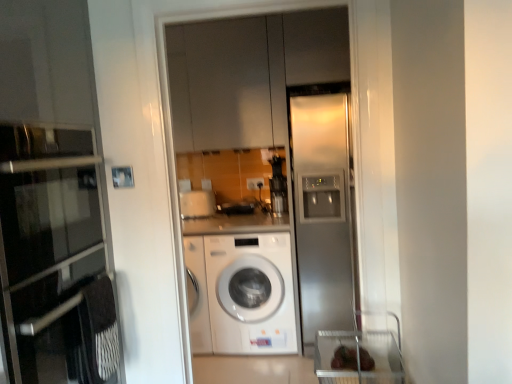
Identify the location of white glossy washing machine at center. This screenshot has width=512, height=384. (251, 294).

What do you see at coordinates (251, 294) in the screenshot? The height and width of the screenshot is (384, 512). I see `white glossy washing machine at center` at bounding box center [251, 294].

Identify the location of satin silver refrigerator at center. (264, 178).

What do you see at coordinates (322, 211) in the screenshot? Image resolution: width=512 pixels, height=384 pixels. I see `stainless steel refrigerator at right` at bounding box center [322, 211].

Identify the location of white matte cabinet at upper center. The width and height of the screenshot is (512, 384). (228, 83).

The height and width of the screenshot is (384, 512). Identify the location of white glossy washing machine at center. pyautogui.click(x=251, y=294).

Which of these two, white matte cabinet at upper center or white plastic electric outlet at center, is bigger?

white matte cabinet at upper center.

Choose the correct answer: Is white matte cabinet at upper center inside white plastic electric outlet at center or outside it?

white matte cabinet at upper center is outside white plastic electric outlet at center.

From a real-world perspective, who is located lower, satin silver refrigerator at center or white glossy washing machine at center?

white glossy washing machine at center, from a real-world perspective.

Based on their sizes in the image, would you say satin silver refrigerator at center is bigger or smaller than white glossy washing machine at center?

In the image, satin silver refrigerator at center appears to be smaller than white glossy washing machine at center.

Is satin silver refrigerator at center wider than white glossy washing machine at center?

No, satin silver refrigerator at center is not wider than white glossy washing machine at center.

From the image's perspective, which one is positioned lower, satin silver refrigerator at center or white glossy washing machine at center?

white glossy washing machine at center.

From a real-world perspective, which object stands above the other?

white matte cabinet at upper center, from a real-world perspective.

What's the angular difference between white matte cabinet at upper center and white glossy washing machine at center's facing directions?

0.00016 degrees separate the facing orientations of white matte cabinet at upper center and white glossy washing machine at center.

In terms of size, does white matte cabinet at upper center appear bigger or smaller than white glossy washing machine at center?

white matte cabinet at upper center is smaller than white glossy washing machine at center.

Is white matte cabinet at upper center with matte glass oven at left?

They are not placed beside each other.

Identify the location of cabinetry behind the matte glass oven at left. (228, 83).

Considering the sizes of objects white matte cabinet at upper center and matte glass oven at left in the image provided, who is taller, white matte cabinet at upper center or matte glass oven at left?

matte glass oven at left is taller.

Does white matte cabinet at upper center come behind matte glass oven at left?

That is True.

From a real-world perspective, is stainless steel refrigerator at right on white matte cabinet at upper center?

No, from a real-world perspective, stainless steel refrigerator at right is not over white matte cabinet at upper center

From the image's perspective, is stainless steel refrigerator at right located above or below white matte cabinet at upper center?

From the image's perspective, stainless steel refrigerator at right appears below white matte cabinet at upper center.

Considering the sizes of objects stainless steel refrigerator at right and white matte cabinet at upper center in the image provided, who is wider, stainless steel refrigerator at right or white matte cabinet at upper center?

Wider between the two is stainless steel refrigerator at right.

How different are the orientations of stainless steel refrigerator at right and white plastic electric outlet at center in degrees?

There is a 0.0011-degree angle between the facing directions of stainless steel refrigerator at right and white plastic electric outlet at center.

Which object is further away from the camera, stainless steel refrigerator at right or white plastic electric outlet at center?

white plastic electric outlet at center is more distant.

Considering the positions of objects stainless steel refrigerator at right and white plastic electric outlet at center in the image provided, who is more to the right, stainless steel refrigerator at right or white plastic electric outlet at center?

stainless steel refrigerator at right is more to the right.

Is stainless steel refrigerator at right positioned far away from white plastic electric outlet at center?

Actually, stainless steel refrigerator at right and white plastic electric outlet at center are a little close together.

Which is behind, point (234, 350) or point (249, 187)?

Positioned behind is point (249, 187).

You are a GUI agent. You are given a task and a screenshot of the screen. Output one action in this format:
    pyautogui.click(x=<x>, y=<y>)
    Task: Click on the glass door above the white plastic electric outlet at center (from a real-world perspective)
    The height and width of the screenshot is (384, 512).
    Given the screenshot: What is the action you would take?
    pyautogui.click(x=264, y=178)

Is satin silver refrigerator at center thinner than white plastic electric outlet at center?

In fact, satin silver refrigerator at center might be wider than white plastic electric outlet at center.

Considering the sizes of objects satin silver refrigerator at center and white plastic electric outlet at center in the image provided, who is smaller, satin silver refrigerator at center or white plastic electric outlet at center?

white plastic electric outlet at center is smaller.

This screenshot has height=384, width=512. Identify the location of electric outlet that is under the white matte cabinet at upper center (from a real-world perspective). (255, 183).

This screenshot has width=512, height=384. There is a white glossy washing machine at center. What are the coordinates of `glass door above it (from a real-world perspective)` in the screenshot? It's located at (264, 178).

Estimate the real-world distances between objects in this image. Which object is closer to stainless steel refrigerator at right, matte glass oven at left or white matte cabinet at upper center?

The object closer to stainless steel refrigerator at right is white matte cabinet at upper center.

When comparing their distances from white matte cabinet at upper center, does white glossy washing machine at center or white plastic electric outlet at center seem further?

white glossy washing machine at center is positioned further to the anchor white matte cabinet at upper center.

From the image, which object appears to be farther from satin silver refrigerator at center, stainless steel refrigerator at right or white matte cabinet at upper center?

white matte cabinet at upper center is further to satin silver refrigerator at center.

When comparing their distances from matte glass oven at left, does white glossy washing machine at center or satin silver refrigerator at center seem closer?

white glossy washing machine at center is positioned closer to the anchor matte glass oven at left.

Considering their positions, is white plastic electric outlet at center positioned further to satin silver refrigerator at center than matte glass oven at left?

matte glass oven at left lies further to satin silver refrigerator at center than the other object.

When comparing their distances from white glossy washing machine at center, does white matte cabinet at upper center or white plastic electric outlet at center seem further?

white matte cabinet at upper center is positioned further to the anchor white glossy washing machine at center.

Estimate the real-world distances between objects in this image. Which object is further from matte glass oven at left, satin silver refrigerator at center or white matte cabinet at upper center?

white matte cabinet at upper center lies further to matte glass oven at left than the other object.

From the image, which object appears to be nearer to matte glass oven at left, white glossy washing machine at center or white matte cabinet at upper center?

white glossy washing machine at center is closer to matte glass oven at left.

The height and width of the screenshot is (384, 512). I want to click on washing machine between stainless steel refrigerator at right and white plastic electric outlet at center along the z-axis, so click(x=251, y=294).

The width and height of the screenshot is (512, 384). I want to click on washing machine located between matte glass oven at left and white plastic electric outlet at center in the depth direction, so click(251, 294).

In order to click on glass door between matte glass oven at left and white matte cabinet at upper center from front to back in this screenshot , I will do `click(264, 178)`.

The image size is (512, 384). In order to click on electric outlet between white matte cabinet at upper center and white glossy washing machine at center vertically in this screenshot , I will do `click(255, 183)`.